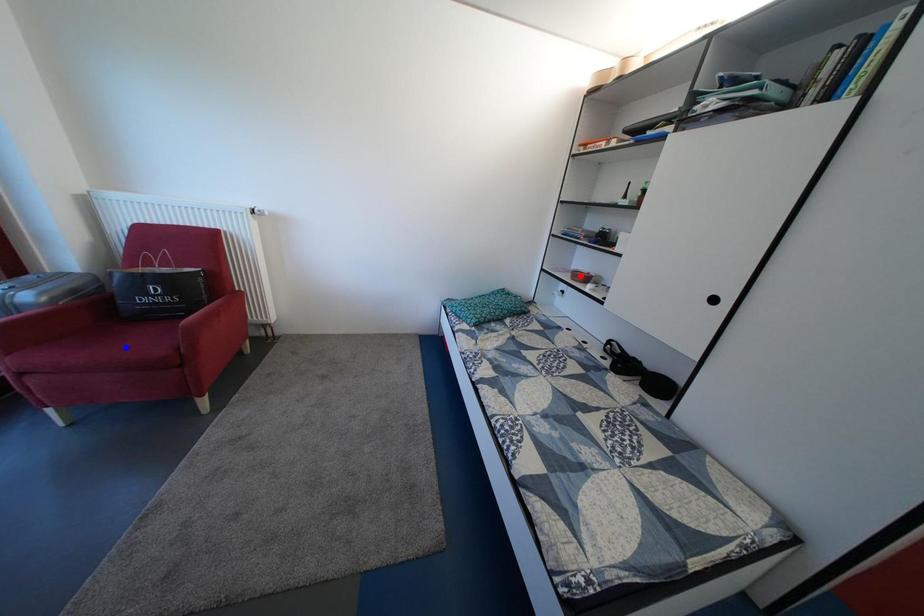
Question: Two points are marked on the image. Which point is closer to the camera?

Choices:
 (A) Blue point is closer.
 (B) Red point is closer.

Answer: (A)